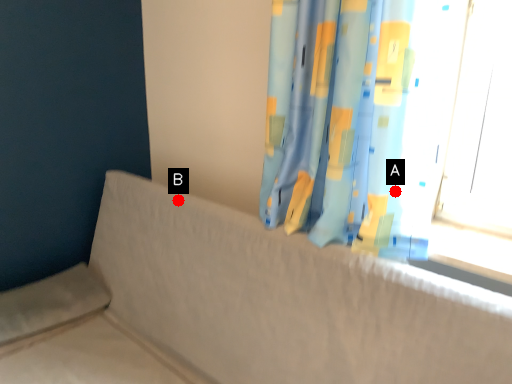
Question: Two points are circled on the image, labeled by A and B beside each circle. Which point is closer to the camera?

Choices:
 (A) A is closer
 (B) B is closer

Answer: (A)